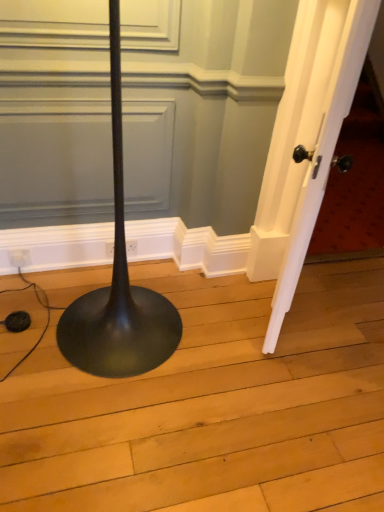
At what (x,y) coordinates should I click in order to perform the action: click on vacant space in front of white wooden door at right. Please return your answer as a coordinate pair (x, y). Looking at the image, I should click on (286, 382).